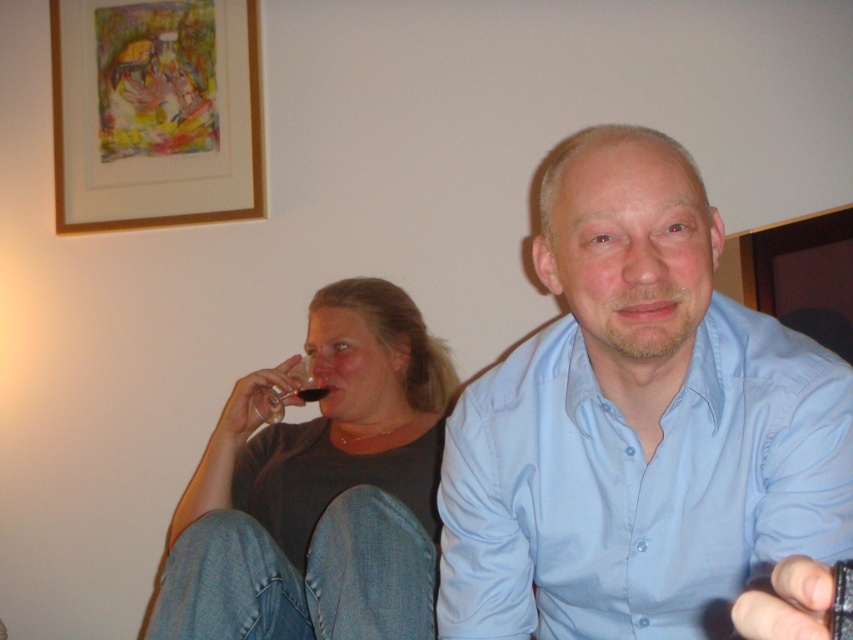
Question: Does wooden picture frame at upper left have a greater width compared to translucent glass at upper center?

Choices:
 (A) yes
 (B) no

Answer: (A)

Question: Does matte glass at center have a lesser width compared to translucent glass at upper center?

Choices:
 (A) yes
 (B) no

Answer: (B)

Question: Among these objects, which one is nearest to the camera?

Choices:
 (A) light blue button-down shirt at center
 (B) wooden picture frame at upper left
 (C) matte glass at center
 (D) transparent glass at upper center

Answer: (A)

Question: Which object appears closest to the camera in this image?

Choices:
 (A) light blue button-down shirt at center
 (B) matte glass at center

Answer: (A)

Question: Which of the following is the farthest from the observer?

Choices:
 (A) (64, 140)
 (B) (846, 412)

Answer: (A)

Question: Does matte glass at center have a smaller size compared to wooden picture frame at upper left?

Choices:
 (A) no
 (B) yes

Answer: (A)